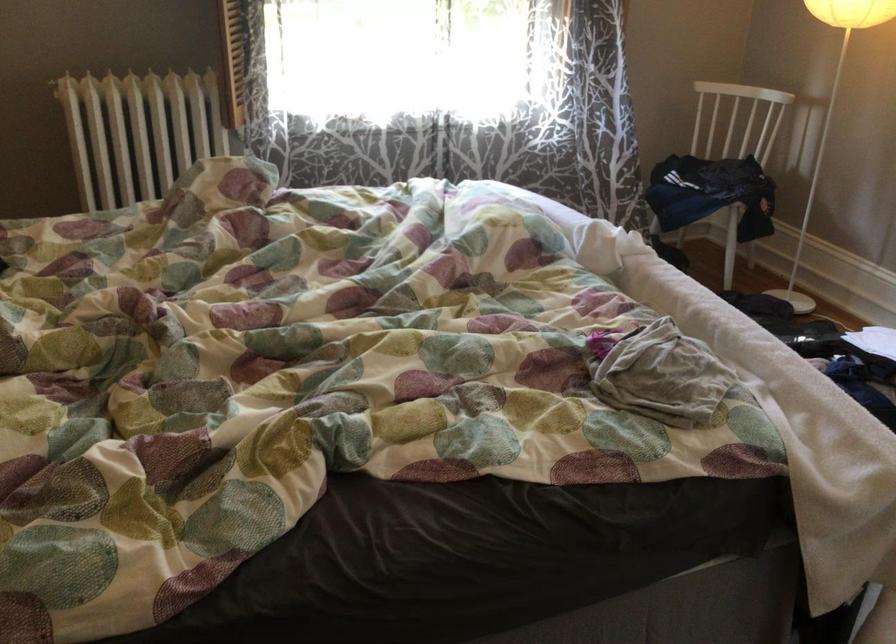
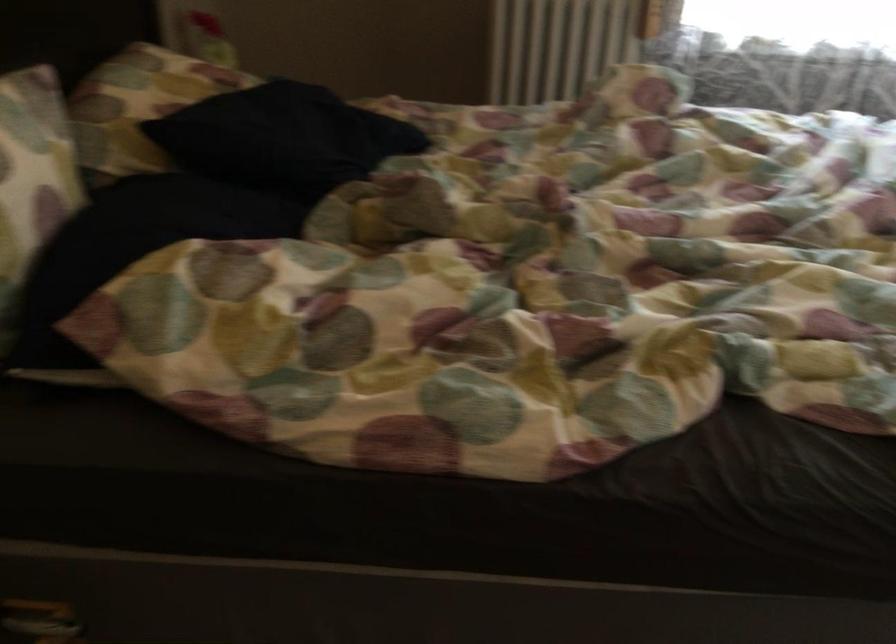
Question: In a continuous first-person perspective shot, in which direction is the camera moving?

Choices:
 (A) Left
 (B) Right
 (C) Forward
 (D) Backward

Answer: (A)